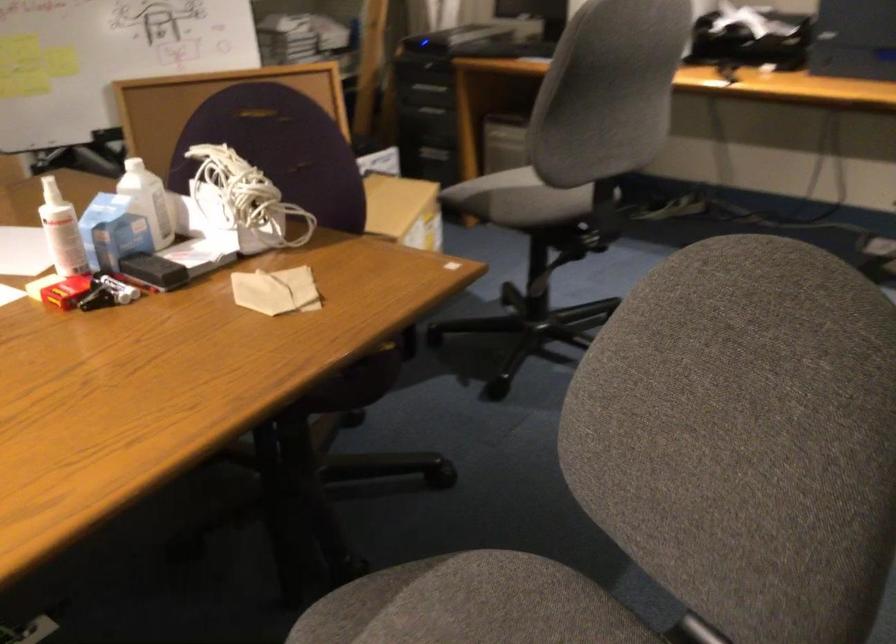
What are the coordinates of `large white bottle` in the screenshot? It's located at (62, 231).